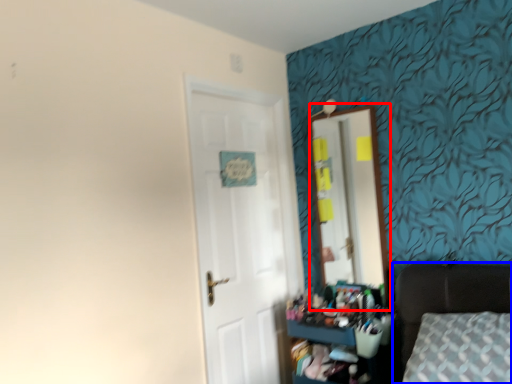
Question: Which object appears closest to the camera in this image, mirror (highlighted by a red box) or furniture (highlighted by a blue box)?

Choices:
 (A) mirror
 (B) furniture

Answer: (B)